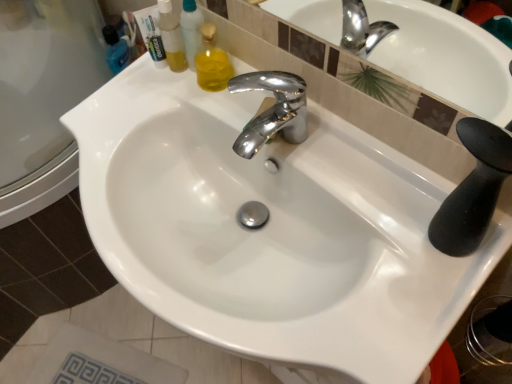
Find the location of `vacant space in front of chrome metallic faucet at center`. vacant space in front of chrome metallic faucet at center is located at coordinates (313, 169).